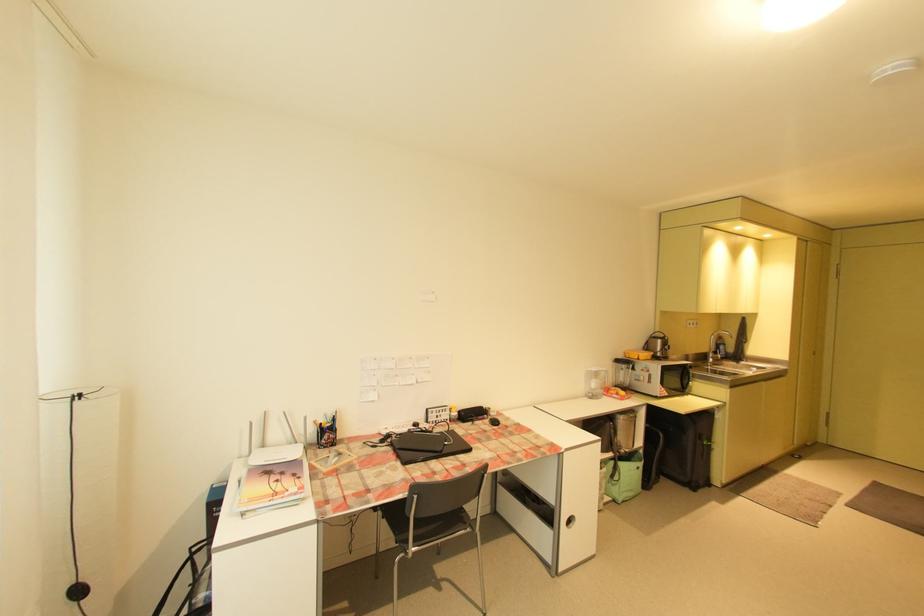
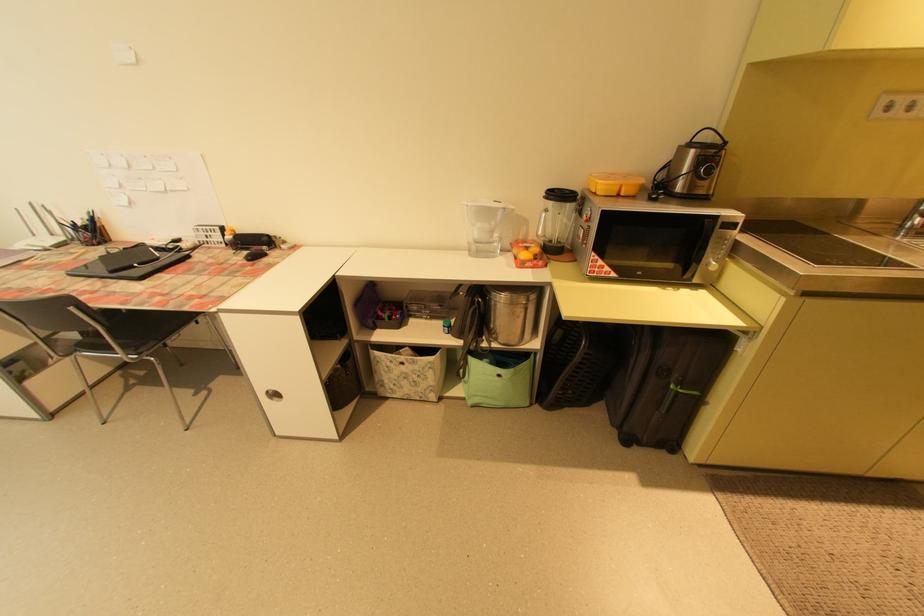
Where in the second image is the point corresponding to (711,444) from the first image?

(678, 387)